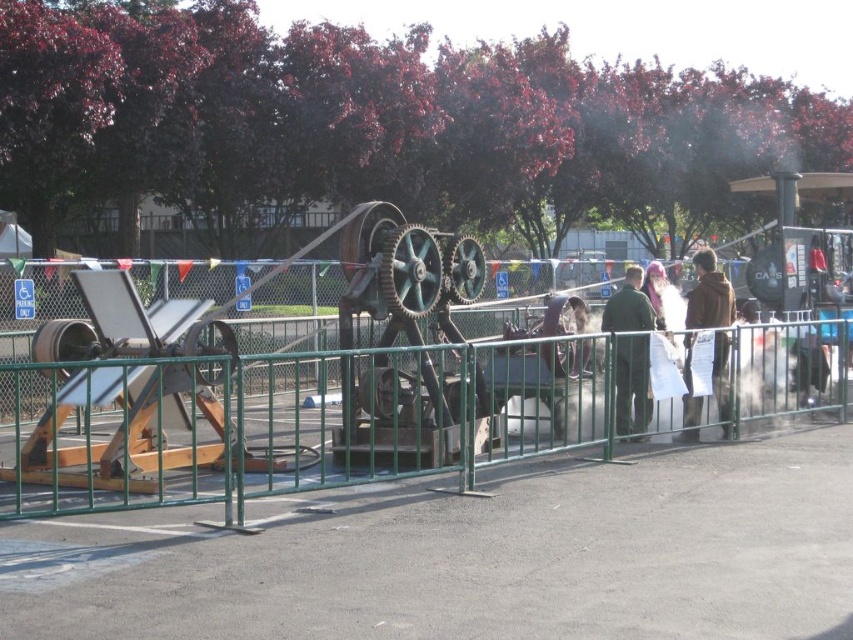
Question: Considering the relative positions of brown fuzzy coat at right and green matte jacket at center in the image provided, where is brown fuzzy coat at right located with respect to green matte jacket at center?

Choices:
 (A) left
 (B) right

Answer: (B)

Question: Is brown fuzzy coat at right below green matte jacket at center?

Choices:
 (A) yes
 (B) no

Answer: (A)

Question: Can you confirm if brown fuzzy coat at right is wider than green matte jacket at center?

Choices:
 (A) no
 (B) yes

Answer: (A)

Question: Which point is closer to the camera taking this photo?

Choices:
 (A) (701, 326)
 (B) (614, 300)

Answer: (B)